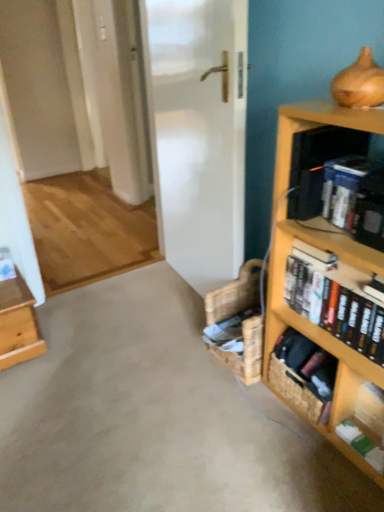
Locate an element on the screen. The width and height of the screenshot is (384, 512). vacant space in front of woven brown basket at lower right is located at coordinates pos(315,456).